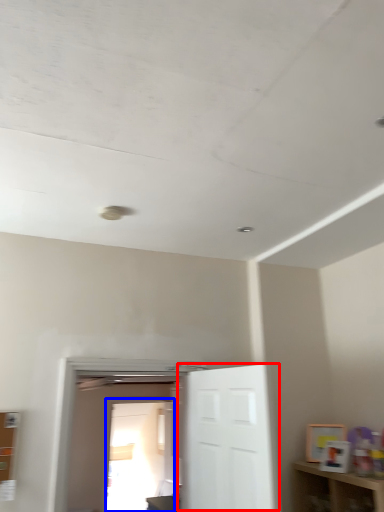
Question: Which object appears closest to the camera in this image, door (highlighted by a red box) or glass door (highlighted by a blue box)?

Choices:
 (A) door
 (B) glass door

Answer: (A)